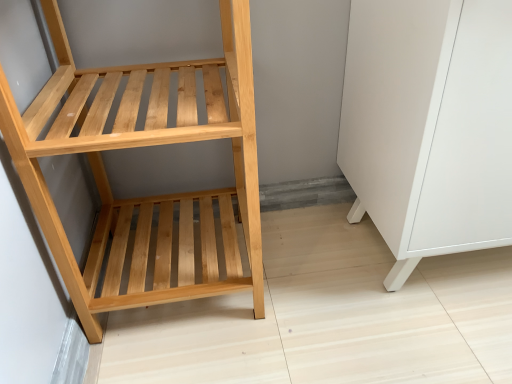
Question: Could you tell me if white matte cabinet at lower right is turned towards natural wood shelf at left?

Choices:
 (A) yes
 (B) no

Answer: (B)

Question: Does white matte cabinet at lower right have a greater height compared to natural wood shelf at left?

Choices:
 (A) yes
 (B) no

Answer: (B)

Question: From the image's perspective, is white matte cabinet at lower right above natural wood shelf at left?

Choices:
 (A) no
 (B) yes

Answer: (B)

Question: From a real-world perspective, does white matte cabinet at lower right stand above natural wood shelf at left?

Choices:
 (A) yes
 (B) no

Answer: (B)

Question: Would you say natural wood shelf at left is part of white matte cabinet at lower right's contents?

Choices:
 (A) yes
 (B) no

Answer: (B)

Question: Is white matte cabinet at lower right positioned far away from natural wood shelf at left?

Choices:
 (A) no
 (B) yes

Answer: (A)

Question: Is natural wood shelf at left completely or partially outside of white matte cabinet at lower right?

Choices:
 (A) no
 (B) yes

Answer: (B)

Question: Is natural wood shelf at left at the right side of white matte cabinet at lower right?

Choices:
 (A) no
 (B) yes

Answer: (A)

Question: Is natural wood shelf at left with white matte cabinet at lower right?

Choices:
 (A) no
 (B) yes

Answer: (A)

Question: Considering the relative sizes of natural wood shelf at left and white matte cabinet at lower right in the image provided, is natural wood shelf at left wider than white matte cabinet at lower right?

Choices:
 (A) yes
 (B) no

Answer: (B)

Question: Does natural wood shelf at left have a lesser height compared to white matte cabinet at lower right?

Choices:
 (A) no
 (B) yes

Answer: (A)

Question: Could you tell me if natural wood shelf at left is turned towards white matte cabinet at lower right?

Choices:
 (A) no
 (B) yes

Answer: (A)

Question: Is point (500, 140) closer or farther from the camera than point (82, 299)?

Choices:
 (A) farther
 (B) closer

Answer: (B)